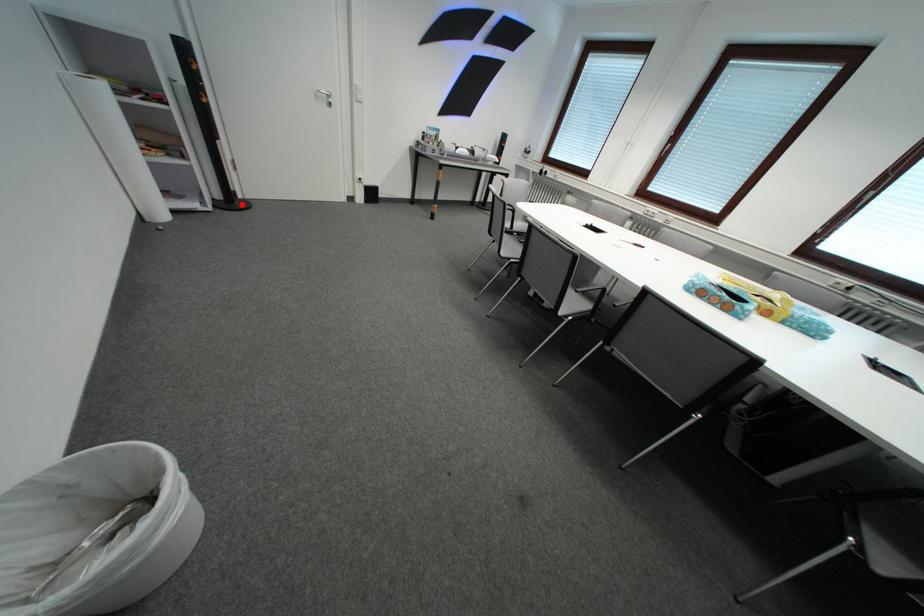
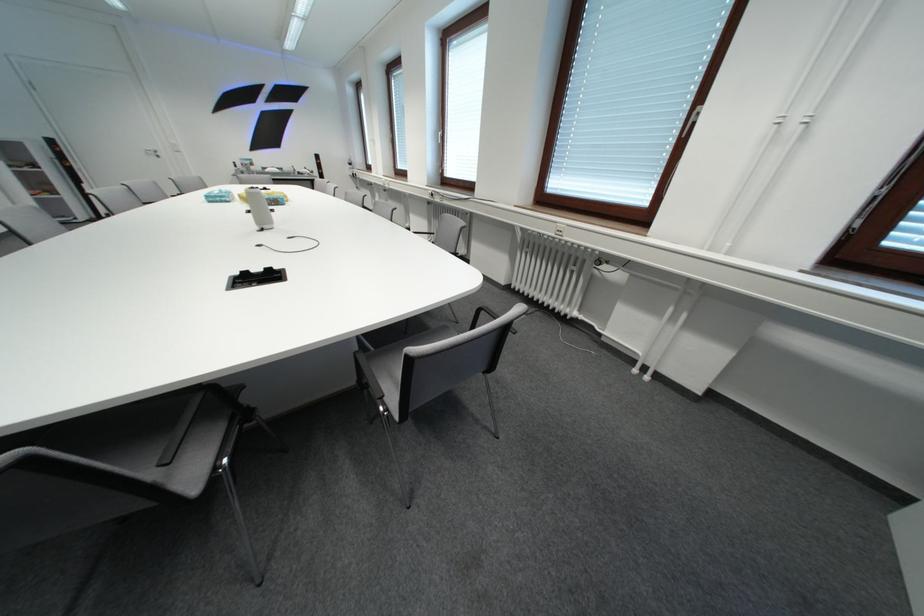
Question: I am providing you with two images of the same scene from different viewpoints. A red point is marked on the first image. Is the red point's position out of view in image 2?

Choices:
 (A) Yes
 (B) No

Answer: (A)